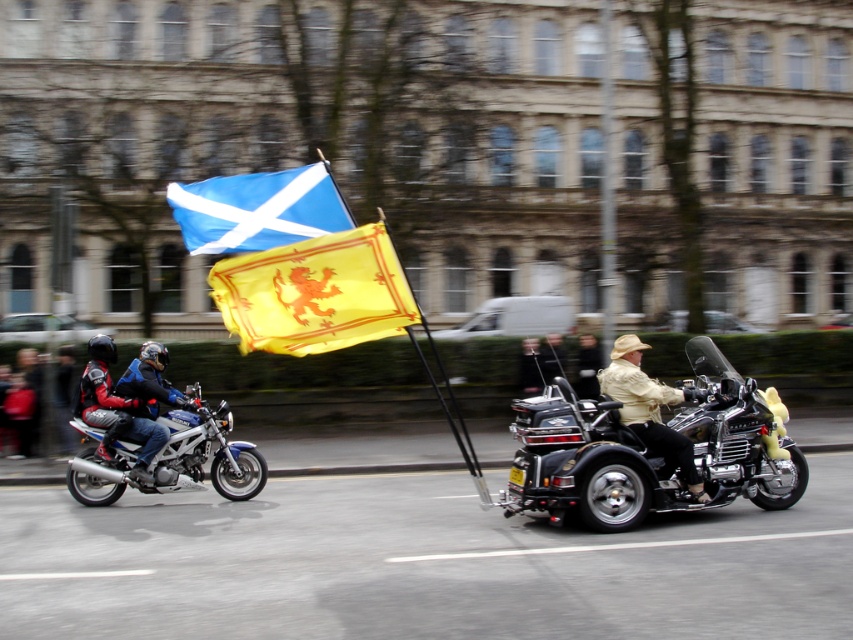
Who is lower down, leather jacket at left or light brown leather jacket at center?

leather jacket at left is below.

Identify the location of leather jacket at left. The image size is (853, 640). (47, 396).

Between blue fabric flag at center and light beige leather jacket at center, which one is positioned lower?

Positioned lower is light beige leather jacket at center.

Is blue fabric flag at center wider than light beige leather jacket at center?

Indeed, blue fabric flag at center has a greater width compared to light beige leather jacket at center.

This screenshot has width=853, height=640. Describe the element at coordinates (257, 209) in the screenshot. I see `blue fabric flag at center` at that location.

This screenshot has height=640, width=853. Find the location of `blue fabric flag at center`. blue fabric flag at center is located at coordinates point(257,209).

Does light beige leather jacket at center have a smaller size compared to leather jacket at left?

Correct, light beige leather jacket at center occupies less space than leather jacket at left.

Identify the location of light beige leather jacket at center. (650, 408).